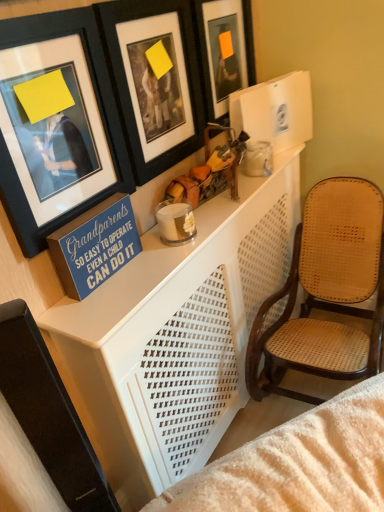
You are a GUI agent. You are given a task and a screenshot of the screen. Output one action in this format:
    pyautogui.click(x=<x>, y=<y>)
    Task: Click on the free space above white perforated table at center (from a real-world perspective)
    Image resolution: width=384 pixels, height=512 pixels.
    Given the screenshot: What is the action you would take?
    pyautogui.click(x=187, y=239)